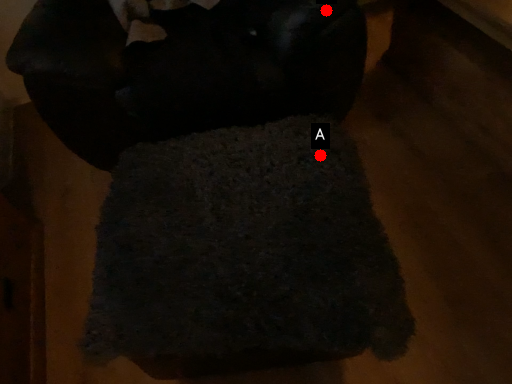
Question: Two points are circled on the image, labeled by A and B beside each circle. Which point is farther to the camera?

Choices:
 (A) A is further
 (B) B is further

Answer: (B)